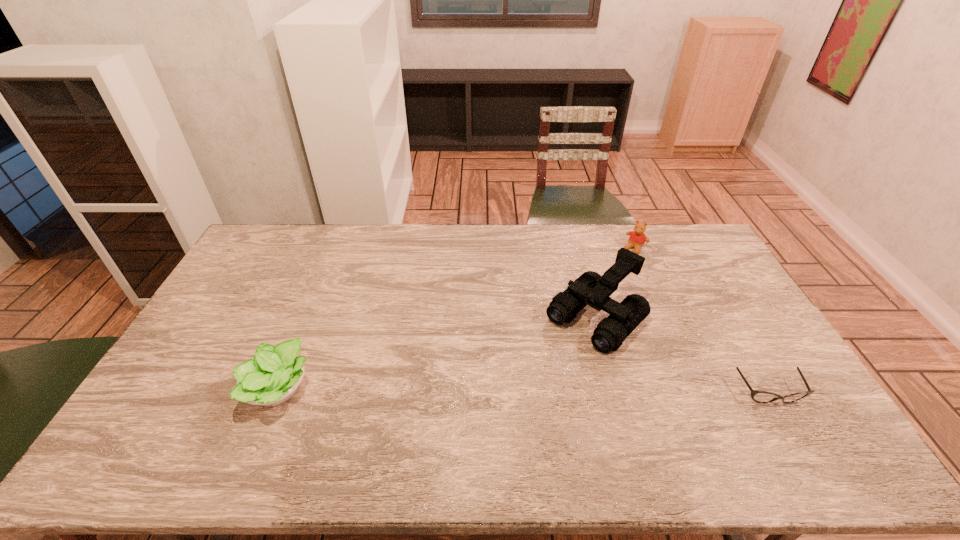
You are a GUI agent. You are given a task and a screenshot of the screen. Output one action in this format:
    pyautogui.click(x=<x>, y=<y>)
    Task: Click on the vacant region located 0.120m on the front-facing side of the second object from right to left
    This screenshot has width=960, height=540.
    Given the screenshot: What is the action you would take?
    pyautogui.click(x=618, y=271)

You are a GUI agent. You are given a task and a screenshot of the screen. Output one action in this format:
    pyautogui.click(x=<x>, y=<y>)
    Task: Click on the free space located on the front-facing side of the second object from right to left
    Image resolution: width=960 pixels, height=540 pixels.
    Given the screenshot: What is the action you would take?
    pyautogui.click(x=620, y=267)

The width and height of the screenshot is (960, 540). What are the coordinates of `free space located on the front lenses of the binoculars` in the screenshot? It's located at (554, 359).

At what (x,y) coordinates should I click in order to perform the action: click on free space located 0.290m on the front lenses of the binoculars. Please return your answer as a coordinate pair (x, y). Image resolution: width=960 pixels, height=540 pixels. Looking at the image, I should click on tap(502, 409).

This screenshot has height=540, width=960. Identify the location of free region located 0.180m on the front lenses of the binoculars. (528, 384).

The image size is (960, 540). I want to click on object present at the far edge, so click(637, 238).

Where is `lettuce situated at the near edge`? The image size is (960, 540). lettuce situated at the near edge is located at coordinates (272, 377).

Locate an element on the screen. spectacles at the near edge is located at coordinates (758, 396).

At what (x,y) coordinates should I click in order to perform the action: click on object located in the right edge section of the desktop. Please return your answer as a coordinate pair (x, y). Looking at the image, I should click on (758, 396).

Locate an element on the screen. object that is positioned at the near right corner is located at coordinates (758, 396).